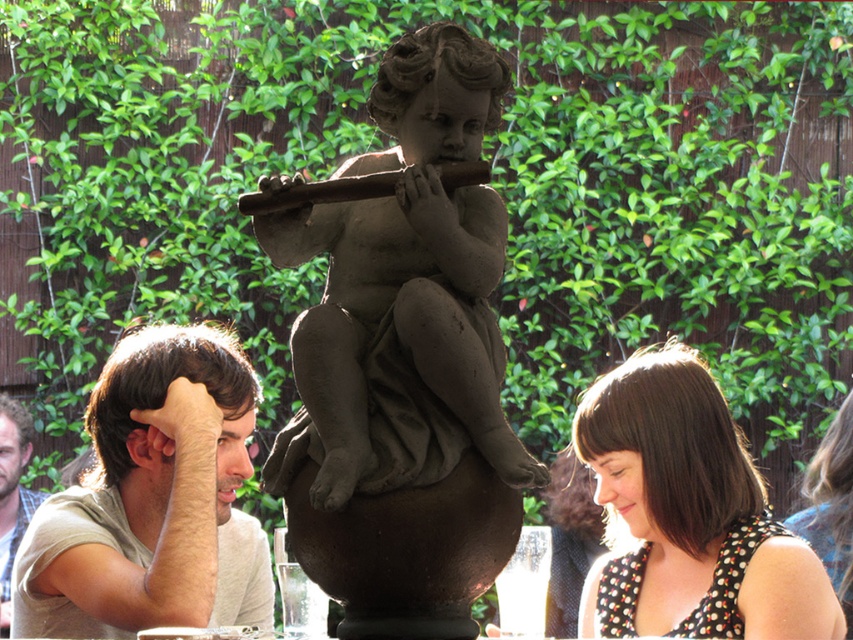
You are a photographer standing in the garden and you notice two people at the left side of the image. One has light brown hair and the other has brown hair. Which person is more to the right when looking at the light brown hair at left and the brown hair man at left?

The light brown hair at left is positioned on the right side of brown hair man at left, so the light brown hair at left is more to the right than the brown hair man at left.

You are standing in the garden and want to take a photo of both the polka dot blouse at lower right and the brown hair man at left. Which object should you frame first in your camera to ensure both fit in the shot?

You should frame the polka dot blouse at lower right first because it is wider than the brown hair man at left, so ensuring it fits will help accommodate the narrower object.

You are a photographer standing in the garden scene. You notice the polka dot blouse at lower right and the brown hair man at left. Which object is closer to you, the photographer?

The polka dot blouse at lower right is in front of the brown hair man at left, so it is closer to you.